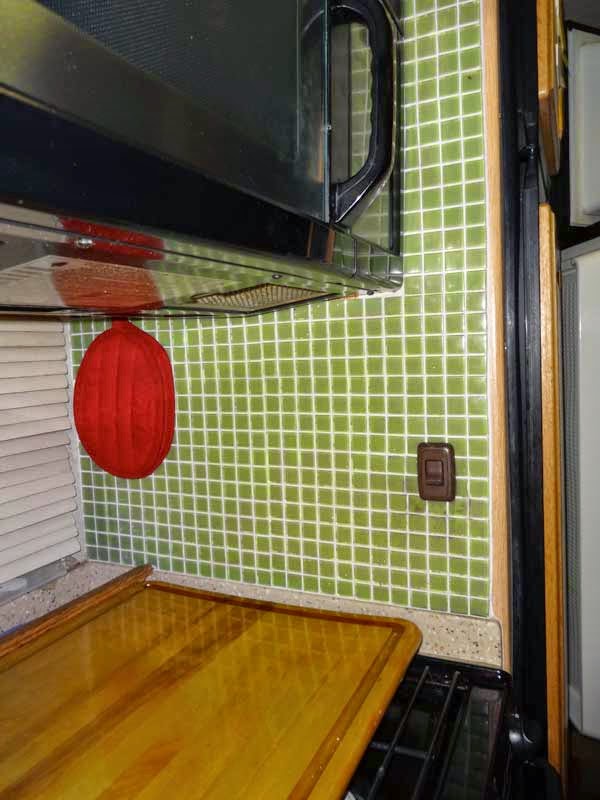
This screenshot has height=800, width=600. Find the location of `stove dial`. stove dial is located at coordinates (523, 734).